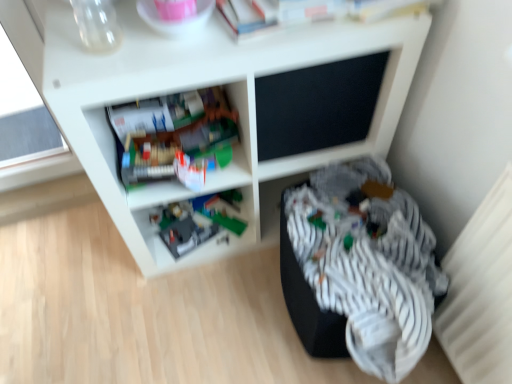
Question: From the image's perspective, is white matte shelf at center, which appears as the second shelf when viewed from the back, under plastic gray toy at lower center, positioned as the first shelf in back-to-front order?

Choices:
 (A) no
 (B) yes

Answer: (A)

Question: Is white matte shelf at center, which appears as the second shelf when viewed from the back, outside plastic gray toy at lower center, the 2th shelf from the front?

Choices:
 (A) no
 (B) yes

Answer: (B)

Question: Does white matte shelf at center, which appears as the second shelf when viewed from the back, come in front of plastic gray toy at lower center, positioned as the first shelf in back-to-front order?

Choices:
 (A) yes
 (B) no

Answer: (A)

Question: From a real-world perspective, is white matte shelf at center, arranged as the 1th shelf when viewed from the front, beneath plastic gray toy at lower center, the 2th shelf from the front?

Choices:
 (A) yes
 (B) no

Answer: (B)

Question: Does white matte shelf at center, arranged as the 1th shelf when viewed from the front, have a smaller size compared to plastic gray toy at lower center, the 2th shelf from the front?

Choices:
 (A) no
 (B) yes

Answer: (A)

Question: Considering their positions, is white matte shelf at center, which appears as the second shelf when viewed from the back, located in front of or behind plastic gray toy at lower center, positioned as the first shelf in back-to-front order?

Choices:
 (A) front
 (B) behind

Answer: (A)

Question: In terms of width, does white matte shelf at center, which appears as the second shelf when viewed from the back, look wider or thinner when compared to plastic gray toy at lower center, positioned as the first shelf in back-to-front order?

Choices:
 (A) thin
 (B) wide

Answer: (B)

Question: Is point (131, 192) positioned closer to the camera than point (192, 261)?

Choices:
 (A) farther
 (B) closer

Answer: (B)

Question: From the image's perspective, is white matte shelf at center, arranged as the 1th shelf when viewed from the front, positioned above or below plastic gray toy at lower center, the 2th shelf from the front?

Choices:
 (A) below
 (B) above

Answer: (B)

Question: Is point (406, 271) positioned closer to the camera than point (139, 205)?

Choices:
 (A) farther
 (B) closer

Answer: (B)

Question: Considering the relative positions of striped fabric at lower right and white matte shelf at center, which appears as the second shelf when viewed from the back, in the image provided, is striped fabric at lower right to the left or to the right of white matte shelf at center, which appears as the second shelf when viewed from the back,?

Choices:
 (A) right
 (B) left

Answer: (A)

Question: Is striped fabric at lower right wider or thinner than white matte shelf at center, arranged as the 1th shelf when viewed from the front?

Choices:
 (A) thin
 (B) wide

Answer: (B)

Question: Would you say striped fabric at lower right is inside or outside white matte shelf at center, arranged as the 1th shelf when viewed from the front?

Choices:
 (A) outside
 (B) inside

Answer: (A)

Question: Looking at their shapes, would you say striped fabric at lower right is wider or thinner than plastic gray toy at lower center, positioned as the first shelf in back-to-front order?

Choices:
 (A) thin
 (B) wide

Answer: (B)

Question: From the image's perspective, is striped fabric at lower right located above or below plastic gray toy at lower center, positioned as the first shelf in back-to-front order?

Choices:
 (A) below
 (B) above

Answer: (A)